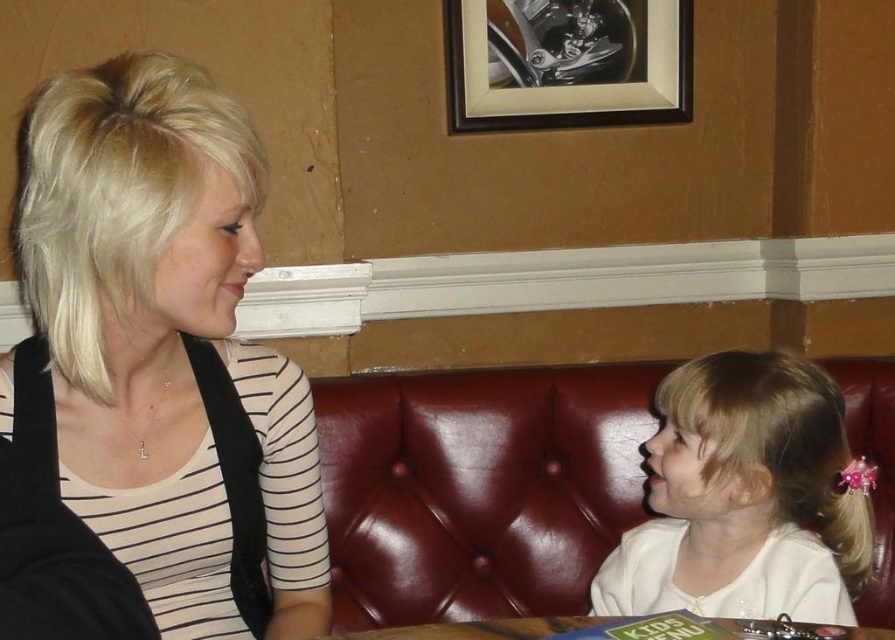
You are a photographer standing at a distance. You want to take a closeup photo of the matte black hair at left. Is the current distance sufficient to capture the hair in detail?

The matte black hair at left is 33.54 inches from camera, so the distance is sufficient to capture the hair in detail.

You are a photographer trying to capture a candid shot of the matte black hair at left without including the wooden framed print at upper center in the background. Is it possible to do so based on their positions?

The matte black hair at left is in front of the wooden framed print at upper center, so yes, it is possible to capture the matte black hair at left without including the wooden framed print at upper center in the background by focusing on the foreground.

You are standing in the restaurant and want to locate the matte black hair at left. According to the scene description, where exactly is it positioned?

The matte black hair at left is located at point 0.552 on the x axis and 0.183 on the y axis.